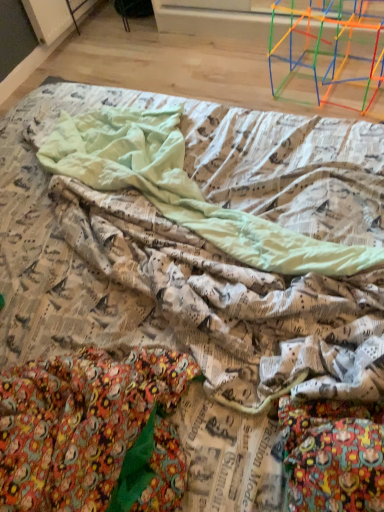
Image resolution: width=384 pixels, height=512 pixels. Describe the element at coordinates (184, 190) in the screenshot. I see `printed newspaper fabric blanket at center` at that location.

Identify the location of printed newspaper fabric blanket at center. [184, 190].

This screenshot has height=512, width=384. I want to click on printed newspaper fabric blanket at center, so click(x=184, y=190).